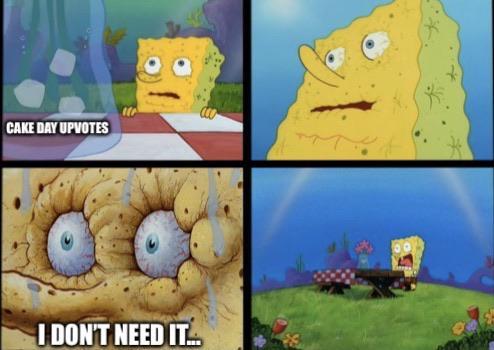
Where is `tablecloth`? The height and width of the screenshot is (350, 494). tablecloth is located at coordinates (332, 277), (147, 136).